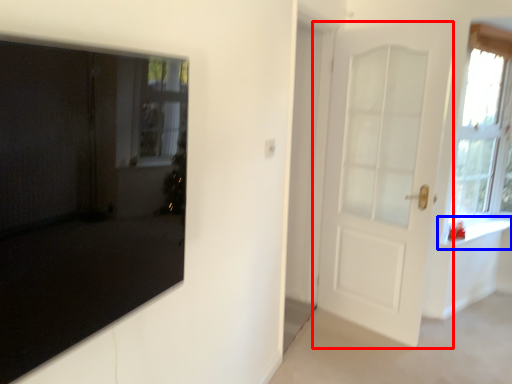
Question: Which object is further to the camera taking this photo, door (highlighted by a red box) or window sill (highlighted by a blue box)?

Choices:
 (A) door
 (B) window sill

Answer: (B)